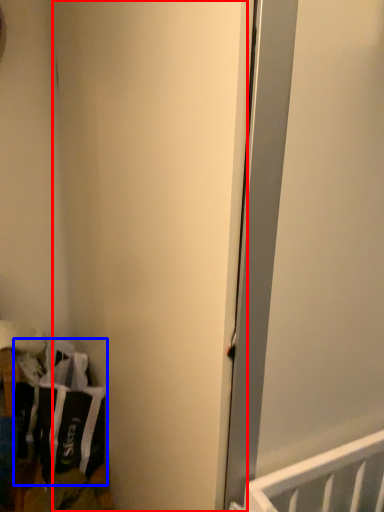
Question: Which object is further to the camera taking this photo, door (highlighted by a red box) or laundry (highlighted by a blue box)?

Choices:
 (A) door
 (B) laundry

Answer: (B)